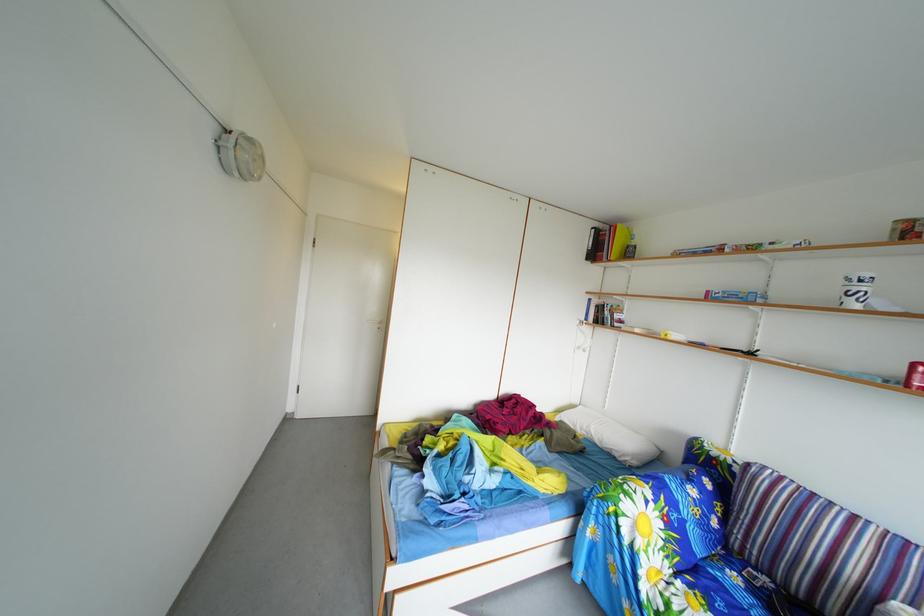
Where is `yellow and white squeegee`? yellow and white squeegee is located at coordinates (673, 336).